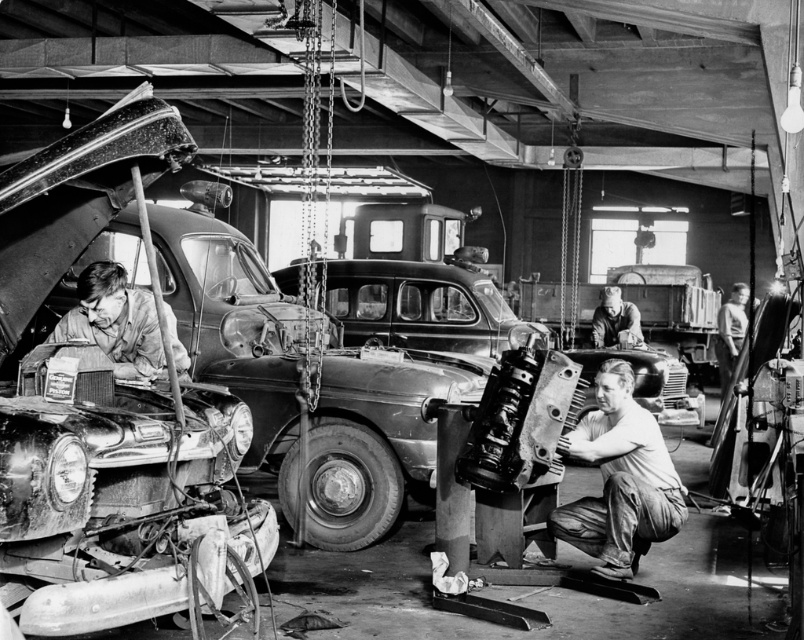
You are a mechanic standing at the entrance of the garage. You need to access the shiny chrome engine at left to fix it. Is the engine positioned in a location that allows you to reach it directly from your current position without moving any obstacles?

The shiny chrome engine at left is located at point (236, 330), which means it is positioned in the lower left quadrant of the garage. Since there are no obstacles mentioned between your current position at the entrance and the engine, you should be able to reach it directly.

Based on the coordinates provided, where is the shiny chrome engine at left located in the image?

The shiny chrome engine at left is located at the coordinates point [236,330].

Based on the photo, you are a mechanic who needs to move a 2.5 meter long tool from the shiny chrome engine at left to the smooth metal cylinder at center. Can you fit the tool between them without bending it?

The distance between the shiny chrome engine at left and the smooth metal cylinder at center is 2.38 meters, which is shorter than the tool length of 2.5 meters. Therefore, the tool cannot be placed straight between them without bending.